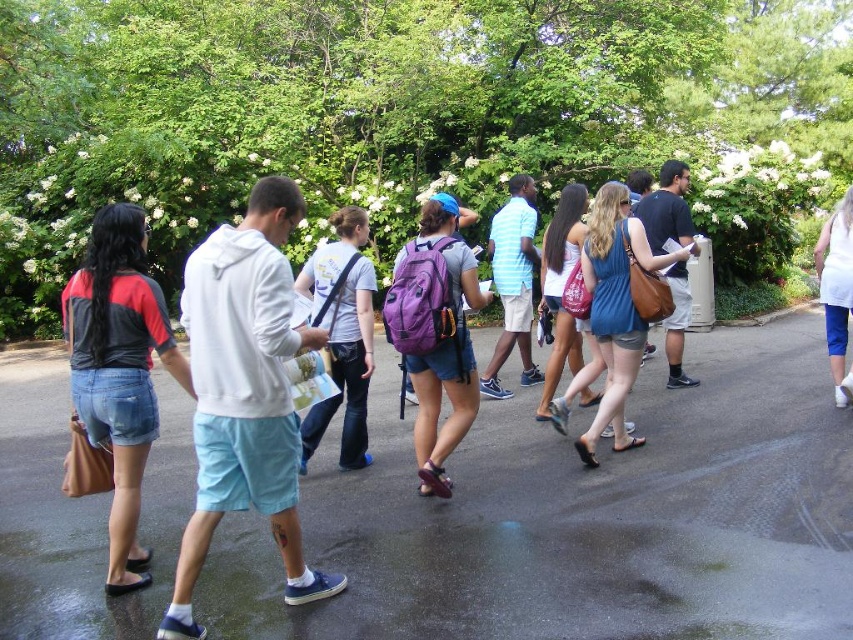
Question: Which point is closer to the camera?

Choices:
 (A) (637, 467)
 (B) (126, 216)
 (C) (289, 310)
 (D) (456, 397)

Answer: (C)

Question: Among these points, which one is nearest to the camera?

Choices:
 (A) (791, 518)
 (B) (132, 506)
 (C) (228, 234)
 (D) (450, 451)

Answer: (C)

Question: Which is nearer to the denim shorts at left?

Choices:
 (A) glossy asphalt pavement at center
 (B) purple matte backpack at center

Answer: (B)

Question: Does white matte hoodie at center have a greater width compared to denim shorts at left?

Choices:
 (A) yes
 (B) no

Answer: (A)

Question: Is denim shorts at left positioned before purple matte backpack at center?

Choices:
 (A) no
 (B) yes

Answer: (B)

Question: Is white matte hoodie at center to the right of denim shorts at left from the viewer's perspective?

Choices:
 (A) yes
 (B) no

Answer: (A)